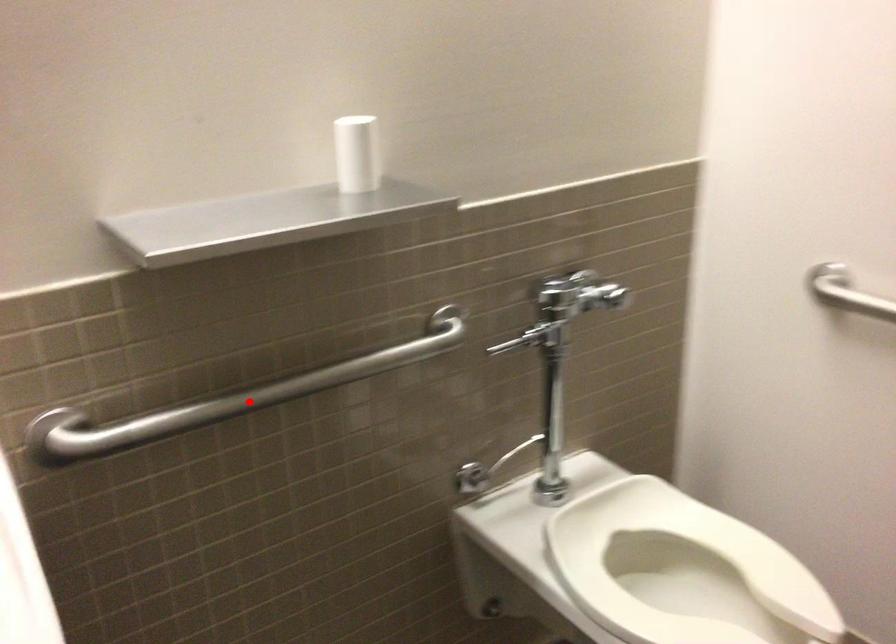
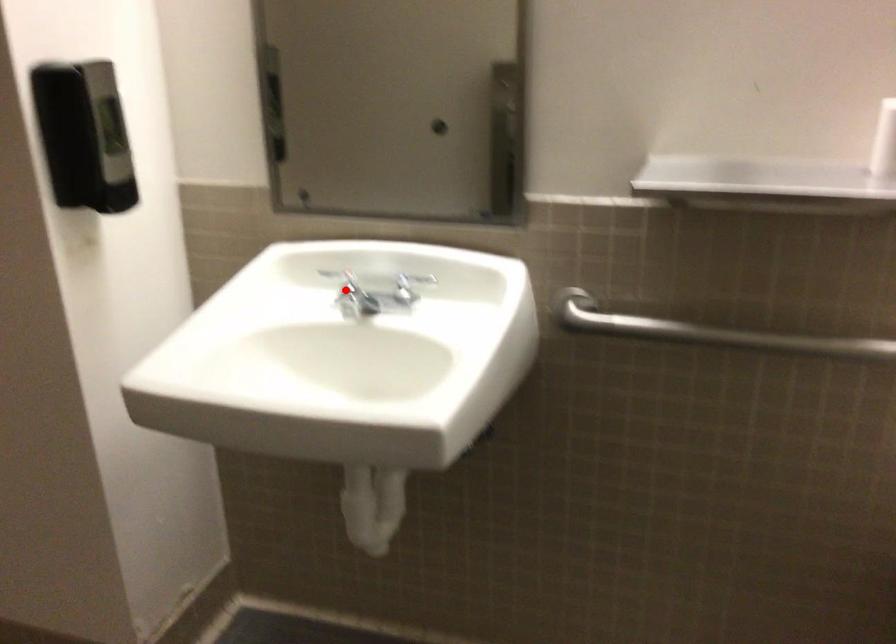
I am providing you with two images of the same scene from different viewpoints. A red point is marked on the first image and another point is marked on the second image. Is the red point in image1 aligned with the point shown in image2?

No